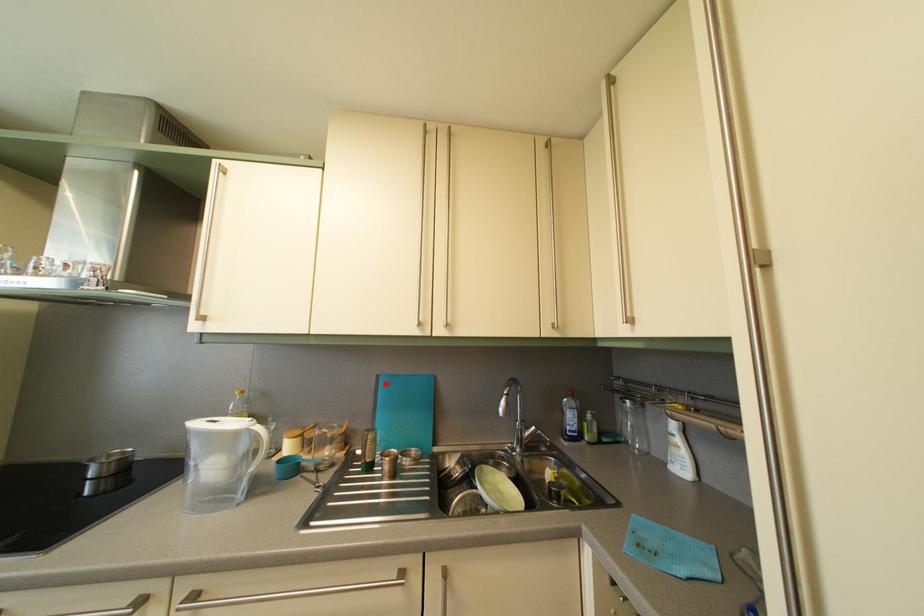
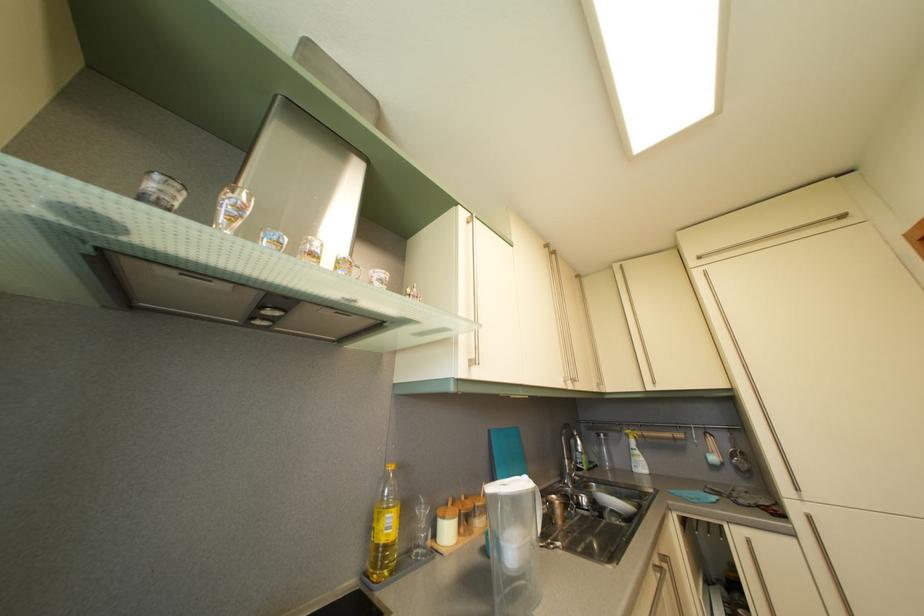
Question: I am providing you with two images of the same scene from different viewpoints. In image1, a red point is highlighted. Considering the same 3D point in image2, which of the following is correct?

Choices:
 (A) It is closer
 (B) It is farther

Answer: (B)